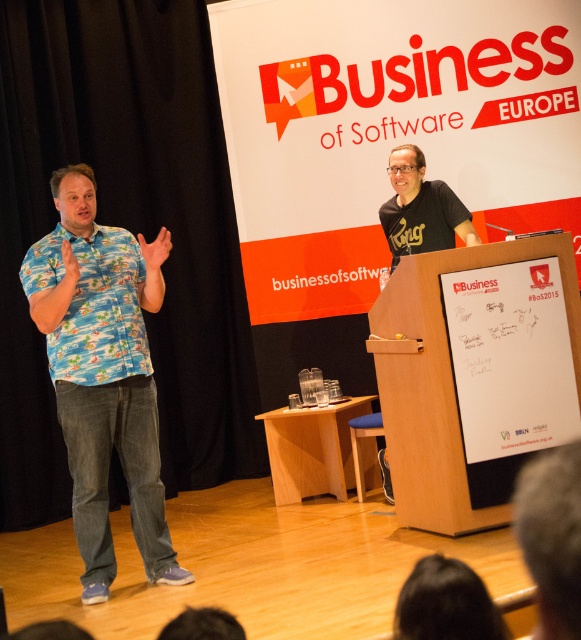
Question: From the image, what is the correct spatial relationship of dark hair at lower center in relation to black matte t-shirt at upper right?

Choices:
 (A) right
 (B) left

Answer: (B)

Question: Among these objects, which one is nearest to the camera?

Choices:
 (A) blue printed shirt at left
 (B) gray hair at upper center

Answer: (B)

Question: Which point is farther from the camera taking this photo?

Choices:
 (A) (411, 618)
 (B) (358, 408)
 (C) (565, 564)

Answer: (B)

Question: Can you confirm if black matte podium at center is positioned below gray hair at upper center?

Choices:
 (A) yes
 (B) no

Answer: (B)

Question: Can you confirm if black matte podium at center is wider than gray hair at upper center?

Choices:
 (A) no
 (B) yes

Answer: (B)

Question: Which object is positioned closest to the blue floral shirt at left?

Choices:
 (A) light wood podium at center
 (B) black matte podium at center
 (C) black matte t-shirt at upper right

Answer: (A)